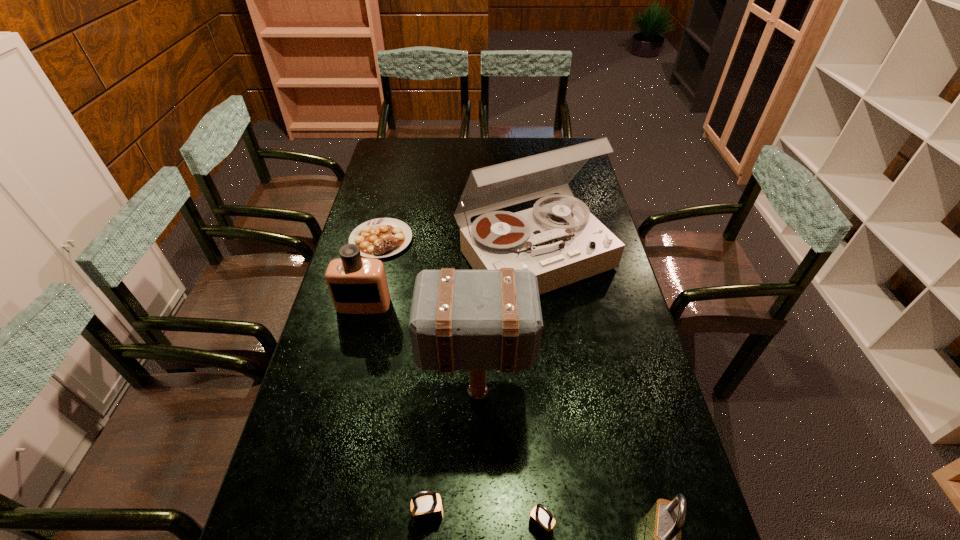
Locate an element on the screen. The height and width of the screenshot is (540, 960). free space located on the front of the record player is located at coordinates tap(547, 358).

At what (x,y) coordinates should I click in order to perform the action: click on free space located on the right of the steak. Please return your answer as a coordinate pair (x, y). This screenshot has height=540, width=960. Looking at the image, I should click on (429, 240).

The height and width of the screenshot is (540, 960). Find the location of `vacant space located 0.120m on the front label of the third tallest object`. vacant space located 0.120m on the front label of the third tallest object is located at coordinates (353, 347).

In order to click on free space located 0.300m on the striking surface of the fourth farthest object in this screenshot , I will do `click(643, 396)`.

The height and width of the screenshot is (540, 960). In order to click on steak present at the left edge in this screenshot , I will do `click(378, 238)`.

The height and width of the screenshot is (540, 960). What are the coordinates of `perfume situated at the left edge` in the screenshot? It's located at (357, 285).

This screenshot has width=960, height=540. I want to click on object that is at the right edge, so click(x=561, y=242).

Locate an element on the screen. The image size is (960, 540). vacant area at the far edge is located at coordinates (466, 156).

In the image, there is a desktop. At what (x,y) coordinates should I click in order to perform the action: click on vacant area at the near edge. Please return your answer as a coordinate pair (x, y). This screenshot has width=960, height=540. Looking at the image, I should click on (518, 529).

The width and height of the screenshot is (960, 540). I want to click on vacant space at the left edge of the desktop, so click(291, 478).